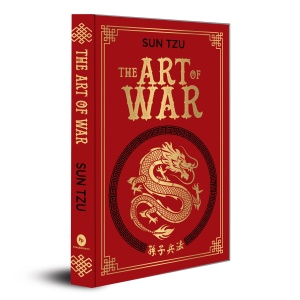
Locate an element on the screen. gold frame design is located at coordinates (104, 48).